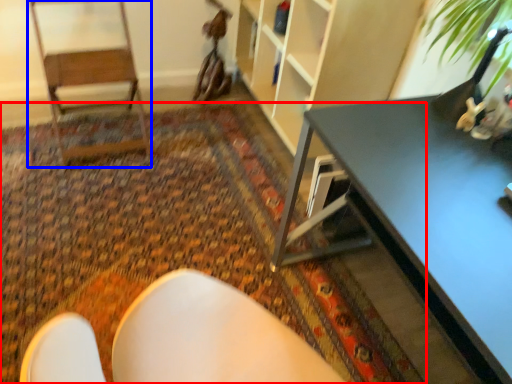
Question: Which object is further to the camera taking this photo, mat (highlighted by a red box) or armchair (highlighted by a blue box)?

Choices:
 (A) mat
 (B) armchair

Answer: (B)